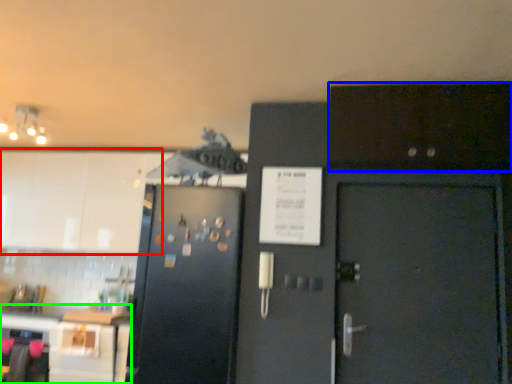
Question: Based on their relative distances, which object is nearer to cabinetry (highlighted by a red box)? Choose from cabinetry (highlighted by a blue box) and table (highlighted by a green box).

Choices:
 (A) cabinetry
 (B) table

Answer: (B)